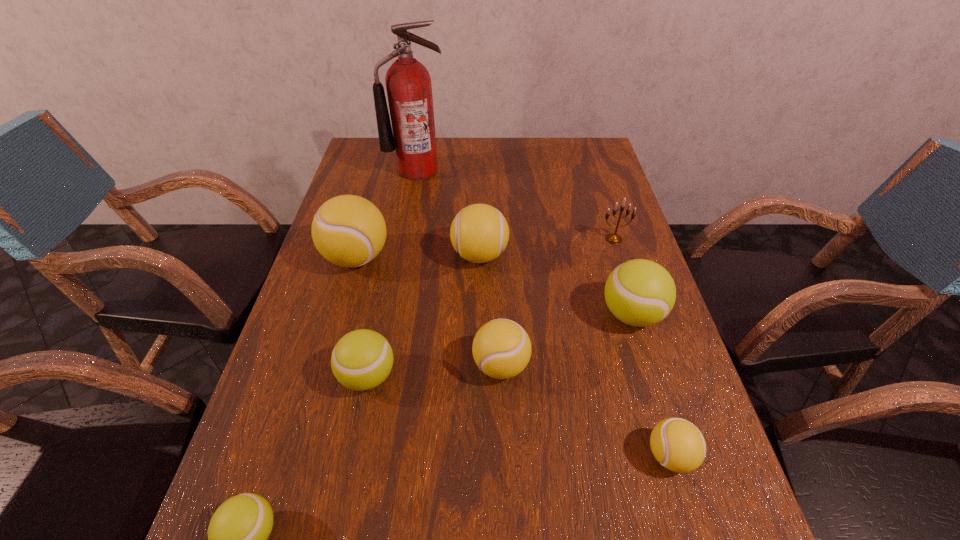
In order to click on unoccupied area between the second green tennis ball from right to left and the second nearest tennis ball in this screenshot , I will do [519, 416].

Locate an element on the screen. empty space between the biggest yellow tennis ball and the rightmost green tennis ball is located at coordinates (494, 286).

Find the location of a particular element. The width and height of the screenshot is (960, 540). free space between the third farthest tennis ball and the tallest tennis ball is located at coordinates (494, 286).

Identify the location of vacant space in between the third smallest yellow tennis ball and the red fire extinguisher. Image resolution: width=960 pixels, height=540 pixels. (448, 213).

Locate which object ranks second in proximity to the second nearest green tennis ball. Please provide its 2D coordinates. Your answer should be formatted as a tuple, i.e. [(x, y)], where the tuple contains the x and y coordinates of a point satisfying the conditions above.

[(238, 531)]

Point out which object is positioned as the sixth nearest to the third smallest yellow tennis ball. Please provide its 2D coordinates. Your answer should be formatted as a tuple, i.e. [(x, y)], where the tuple contains the x and y coordinates of a point satisfying the conditions above.

[(409, 90)]

Locate which tennis ball is the closest to the fifth nearest tennis ball. Please provide its 2D coordinates. Your answer should be formatted as a tuple, i.e. [(x, y)], where the tuple contains the x and y coordinates of a point satisfying the conditions above.

[(501, 348)]

Locate which tennis ball is the sixth closest to the smallest yellow tennis ball. Please provide its 2D coordinates. Your answer should be formatted as a tuple, i.e. [(x, y)], where the tuple contains the x and y coordinates of a point satisfying the conditions above.

[(349, 231)]

Find the location of a particular element. The height and width of the screenshot is (540, 960). yellow tennis ball object that ranks as the second closest to the red fire extinguisher is located at coordinates (479, 232).

Image resolution: width=960 pixels, height=540 pixels. Identify the location of yellow tennis ball that can be found as the second closest to the nearest green tennis ball. (349, 231).